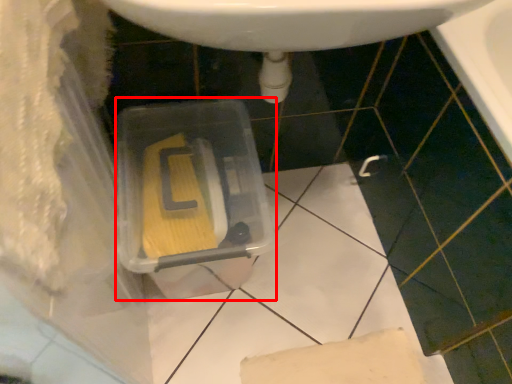
Question: From the image's perspective, what is the correct spatial relationship of storage box (annotated by the red box) in relation to sink?

Choices:
 (A) below
 (B) above

Answer: (A)